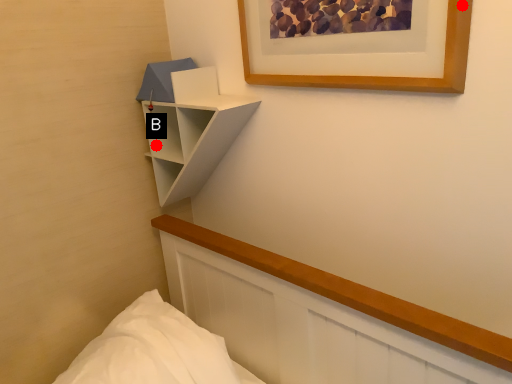
Question: Two points are circled on the image, labeled by A and B beside each circle. Which point is further to the camera?

Choices:
 (A) A is further
 (B) B is further

Answer: (B)